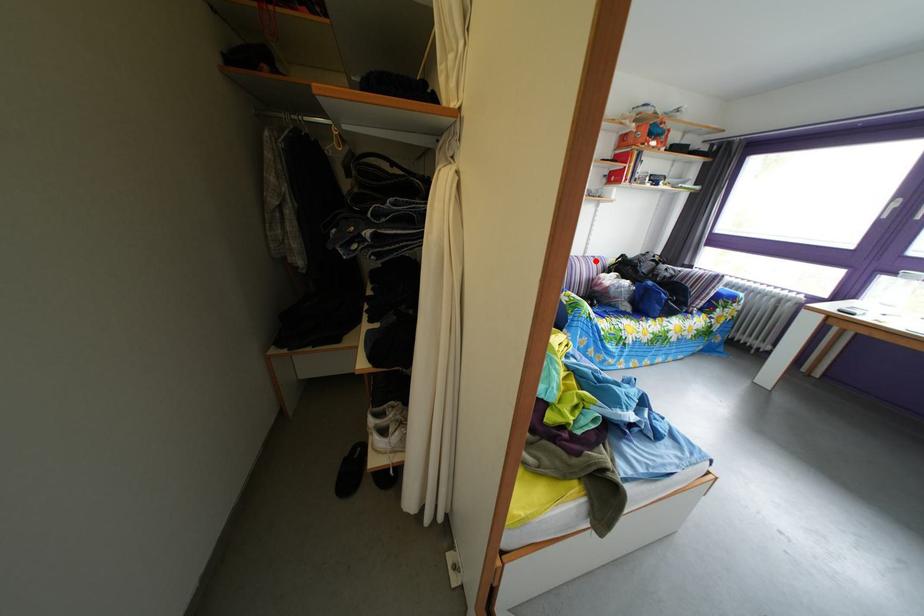
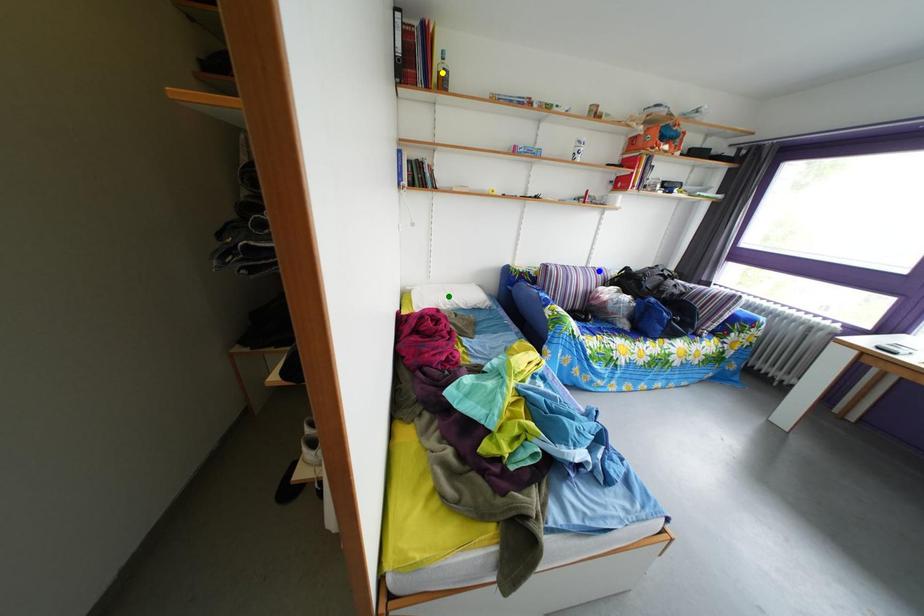
Question: I am providing you with two images of the same scene from different viewpoints. A red point is marked on the first image. You are given multiple points on the second image. Which point in image 2 is actually the same real-world point as the red point in image 1?

Choices:
 (A) blue point
 (B) green point
 (C) yellow point

Answer: (A)